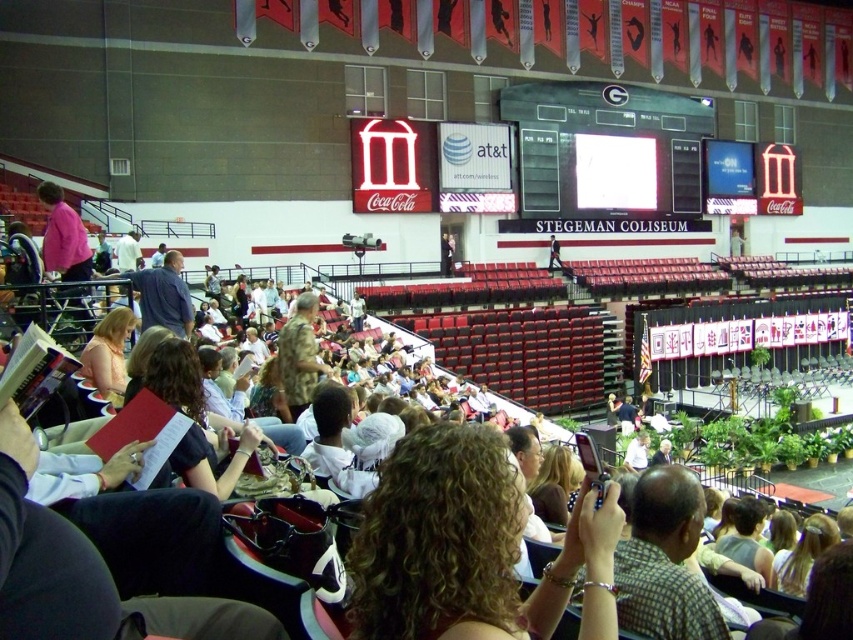
Question: Can you confirm if curly hair at center is wider than camouflage uniform at center?

Choices:
 (A) no
 (B) yes

Answer: (A)

Question: Is the position of curly hair at center less distant than that of camouflage uniform at center?

Choices:
 (A) no
 (B) yes

Answer: (B)

Question: Which is nearer to the curly hair at center?

Choices:
 (A) black glossy scoreboard at center
 (B) camouflage uniform at center

Answer: (B)

Question: Can you confirm if black glossy scoreboard at center is thinner than camouflage uniform at center?

Choices:
 (A) yes
 (B) no

Answer: (B)

Question: Which object is positioned closest to the black glossy scoreboard at center?

Choices:
 (A) camouflage uniform at center
 (B) curly hair at center

Answer: (A)

Question: Which object is closer to the camera taking this photo?

Choices:
 (A) camouflage uniform at center
 (B) black glossy scoreboard at center

Answer: (A)